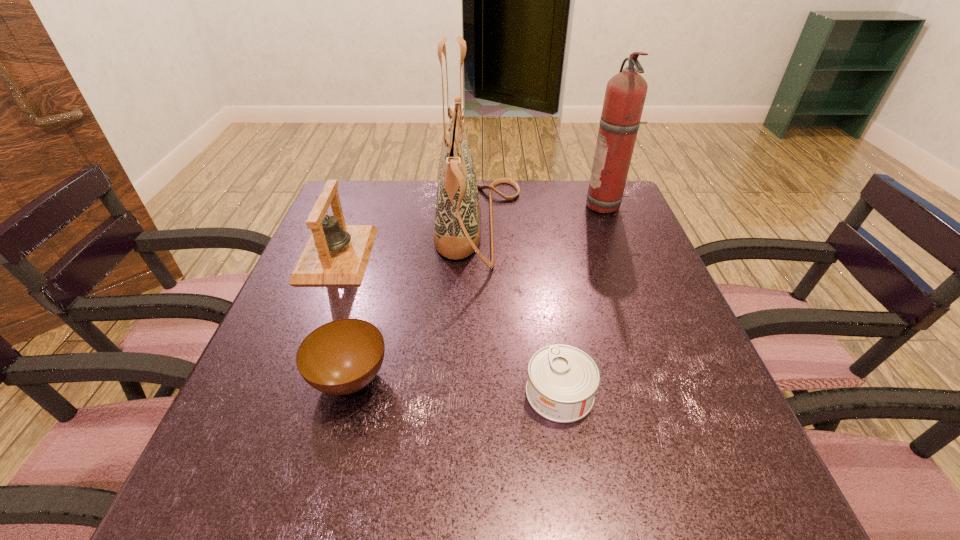
Where is `vacant region located on the front of the bowl`? The width and height of the screenshot is (960, 540). vacant region located on the front of the bowl is located at coordinates (328, 461).

The height and width of the screenshot is (540, 960). In order to click on vacant space situated on the back of the shortest object in this screenshot , I will do `click(536, 241)`.

Find the location of a particular element. This screenshot has width=960, height=540. handbag at the far edge is located at coordinates (457, 233).

Identify the location of fire extinguisher that is at the far edge. (625, 94).

Where is `bell that is at the left edge`? bell that is at the left edge is located at coordinates (336, 253).

Find the location of a particular element. Image resolution: width=960 pixels, height=540 pixels. bowl that is at the left edge is located at coordinates (341, 357).

Image resolution: width=960 pixels, height=540 pixels. I want to click on object located at the right edge, so click(x=625, y=94).

This screenshot has height=540, width=960. I want to click on object that is at the far right corner, so click(x=625, y=94).

I want to click on vacant region at the far edge of the desktop, so click(394, 189).

The height and width of the screenshot is (540, 960). I want to click on free region at the near edge of the desktop, so click(410, 502).